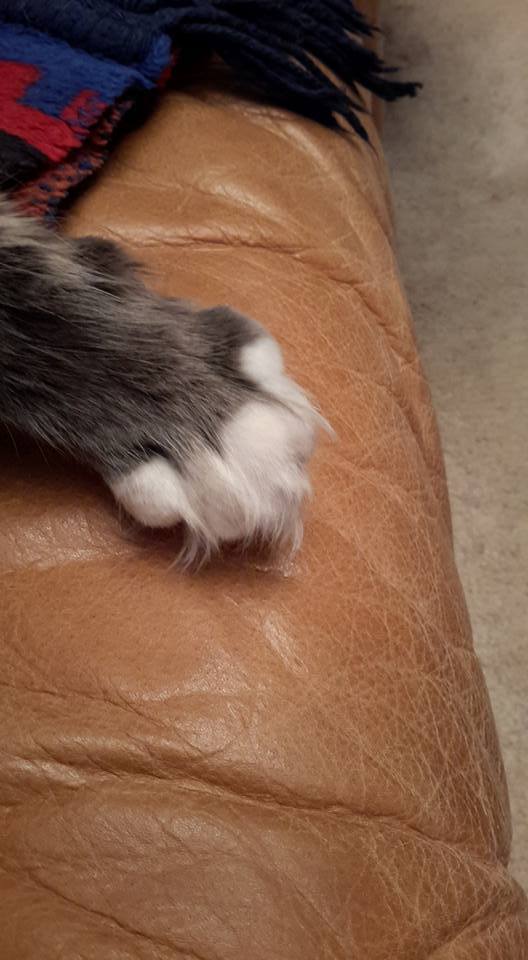
Where is `white fur`? white fur is located at coordinates (252, 427).